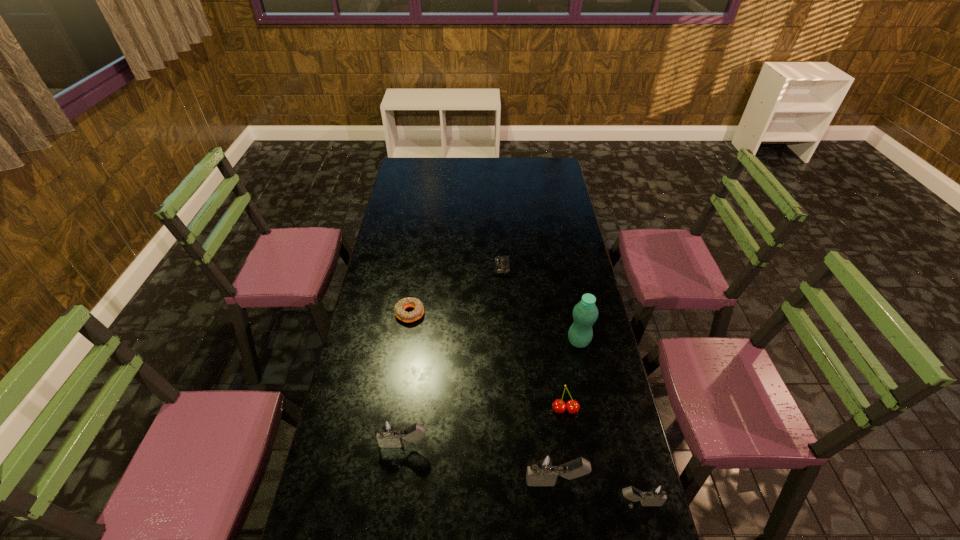
I want to click on free space at the left edge, so click(x=359, y=414).

Locate an element on the screen. The width and height of the screenshot is (960, 540). vacant space at the right edge of the desktop is located at coordinates (571, 223).

This screenshot has width=960, height=540. In the image, there is a desktop. Find the location of `free space at the near right corner`. free space at the near right corner is located at coordinates (624, 522).

The height and width of the screenshot is (540, 960). I want to click on vacant area that lies between the fourth nearest object and the second igniter from right to left, so click(x=561, y=446).

Where is `blank region between the fourth nearest object and the third object from left to right`? The width and height of the screenshot is (960, 540). blank region between the fourth nearest object and the third object from left to right is located at coordinates (534, 339).

Identify the location of empty location between the rightmost igniter and the sixth nearest object. The width and height of the screenshot is (960, 540). (524, 408).

You are a GUI agent. You are given a task and a screenshot of the screen. Output one action in this format:
    pyautogui.click(x=<x>, y=<y>)
    Task: Click on the free point between the fifth object from right to left and the rightmost igniter
    
    Given the screenshot: What is the action you would take?
    pyautogui.click(x=570, y=385)

At what (x,y) coordinates should I click in order to perform the action: click on vacant space that is in between the water bottle and the farthest object. Please return your answer as a coordinate pair (x, y). Looking at the image, I should click on (540, 305).

Find the location of a particular element. The height and width of the screenshot is (540, 960). free space between the fourth nearest object and the second shortest object is located at coordinates (488, 362).

Where is `free spot between the third object from left to right and the second igniter from right to left`? This screenshot has width=960, height=540. free spot between the third object from left to right and the second igniter from right to left is located at coordinates (529, 375).